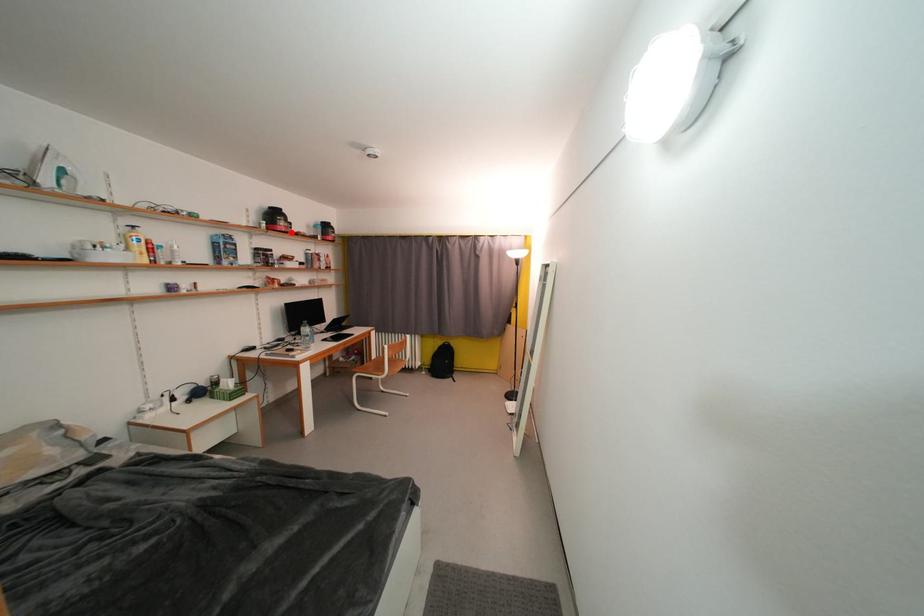
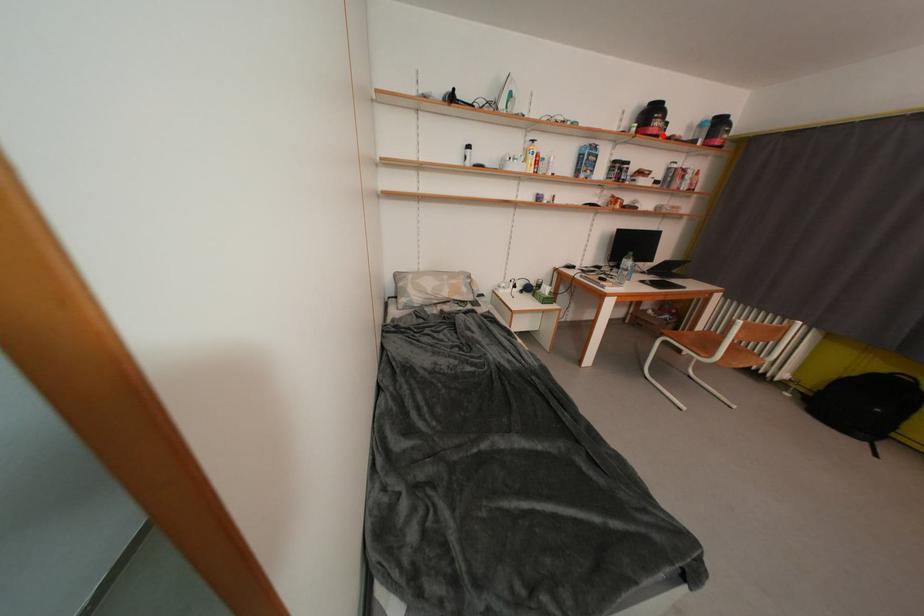
I am providing you with two images of the same scene from different viewpoints. A red point is marked on the first image and another point is marked on the second image. Does the point marked in image1 correspond to the same location as the one in image2?

Yes